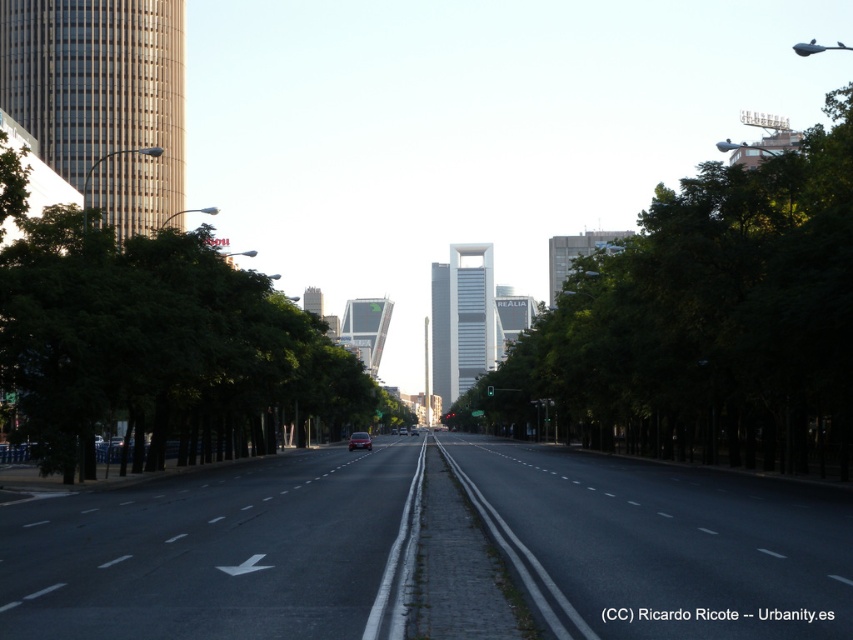
Which is behind, point (770, 273) or point (15, 401)?

Positioned behind is point (15, 401).

Is green leafy tree at center shorter than green leafy tree at left?

No, green leafy tree at center is not shorter than green leafy tree at left.

The width and height of the screenshot is (853, 640). Describe the element at coordinates (705, 323) in the screenshot. I see `green leafy tree at center` at that location.

At what (x,y) coordinates should I click in order to perform the action: click on green leafy tree at center. Please return your answer as a coordinate pair (x, y). The width and height of the screenshot is (853, 640). Looking at the image, I should click on (705, 323).

Consider the image. Does green leafy tree at center have a lesser height compared to metallic silver car at center?

No, green leafy tree at center is not shorter than metallic silver car at center.

Who is lower down, green leafy tree at center or metallic silver car at center?

metallic silver car at center is below.

Which is behind, point (631, 348) or point (351, 445)?

The point (351, 445) is more distant.

At what (x,y) coordinates should I click in order to perform the action: click on green leafy tree at center. Please return your answer as a coordinate pair (x, y). Image resolution: width=853 pixels, height=640 pixels. Looking at the image, I should click on (705, 323).

Who is shorter, green leafy tree at left or metallic silver car at center?

With less height is metallic silver car at center.

Does green leafy tree at left lie in front of metallic silver car at center?

Yes, it is in front of metallic silver car at center.

Is point (38, 266) positioned in front of point (361, 445)?

Yes, point (38, 266) is in front of point (361, 445).

Locate an element on the screen. Image resolution: width=853 pixels, height=640 pixels. green leafy tree at left is located at coordinates (155, 348).